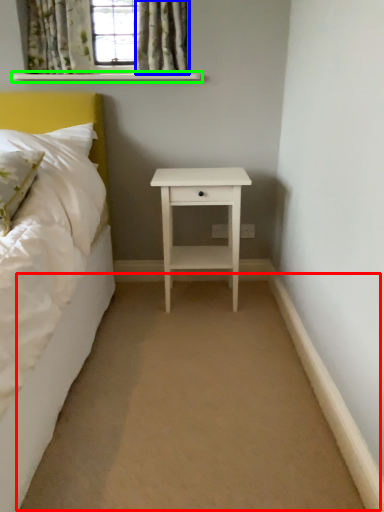
Question: Estimate the real-world distances between objects in this image. Which object is closer to plain (highlighted by a red box), curtain (highlighted by a blue box) or window sill (highlighted by a green box)?

Choices:
 (A) curtain
 (B) window sill

Answer: (A)